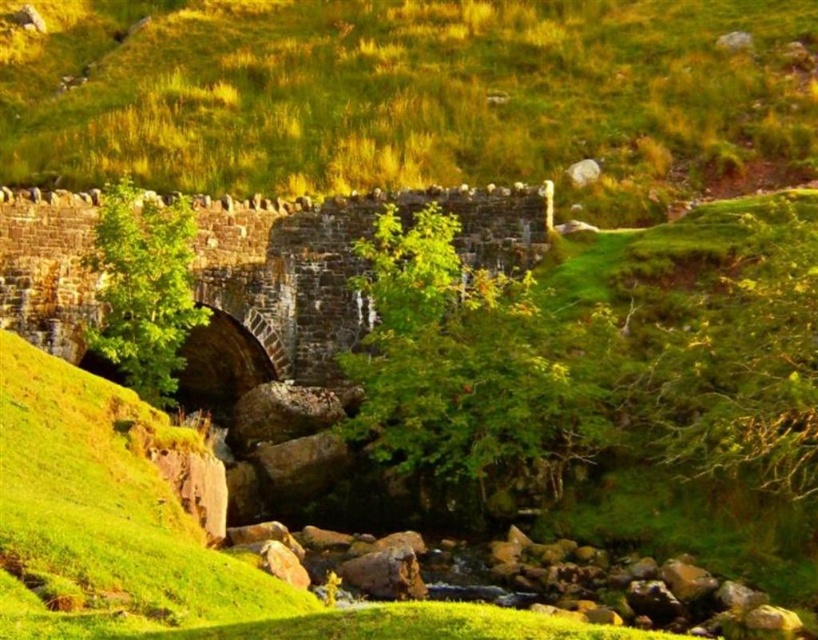
You are standing at the stone bridge and looking towards the stream. There are two points marked in the image, point A at coordinates point (151, 65) and point B at coordinates point (223, 397). Which point is closer to your current position?

Point A at coordinates point (151, 65) is closer to your current position because it is further to the camera than point B at coordinates point (223, 397), meaning it is nearer to the observer standing at the bridge.